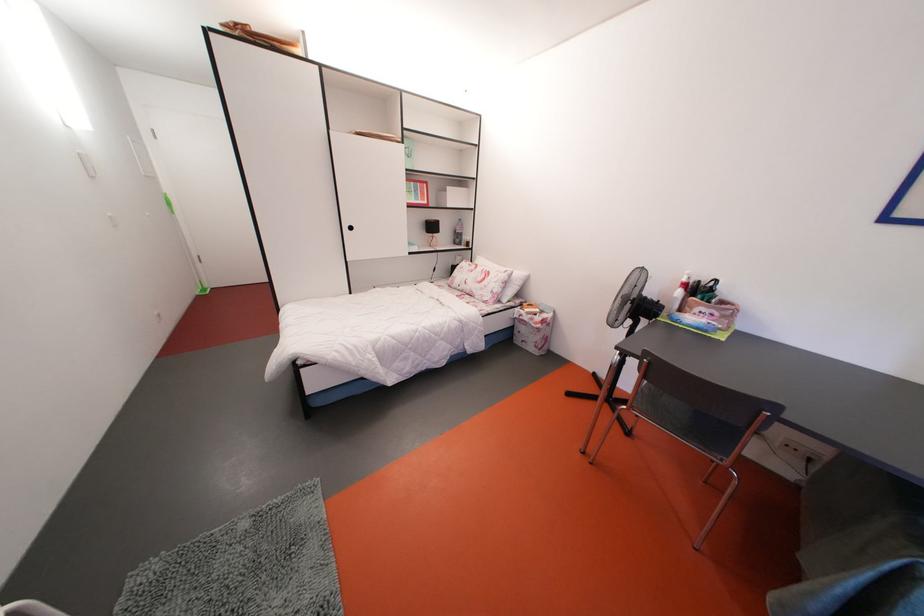
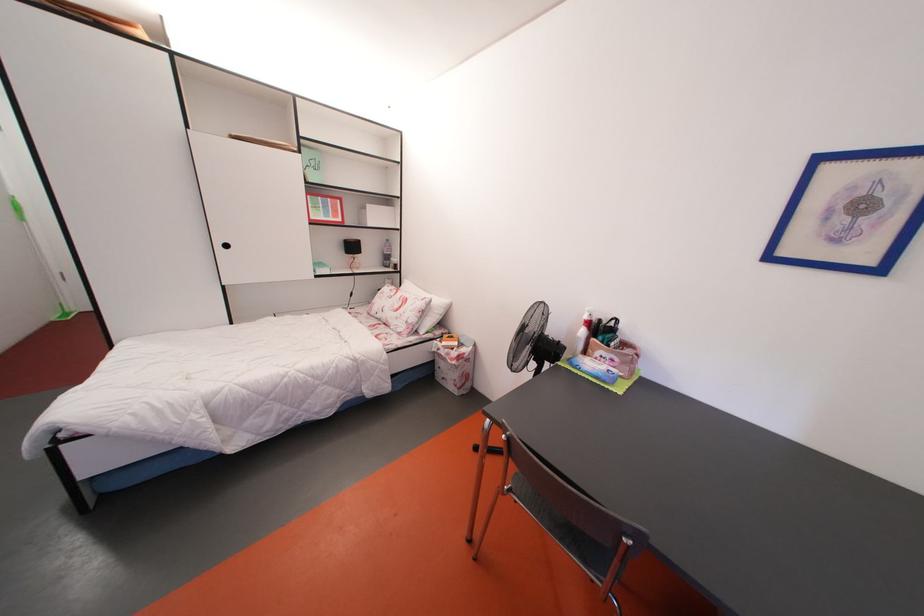
Find the pixel in the second image that matches point (502, 297) in the first image.

(417, 326)